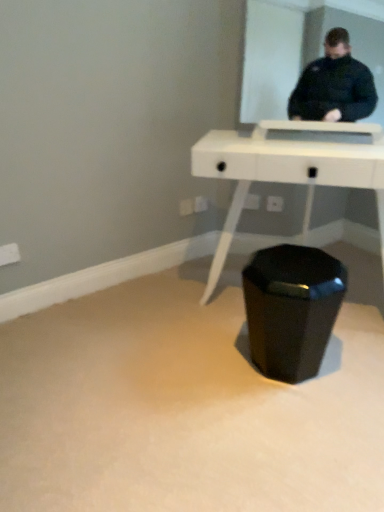
The image size is (384, 512). Find the location of `free area in between white glossy table at center and black glossy waste container at center`. free area in between white glossy table at center and black glossy waste container at center is located at coordinates (245, 349).